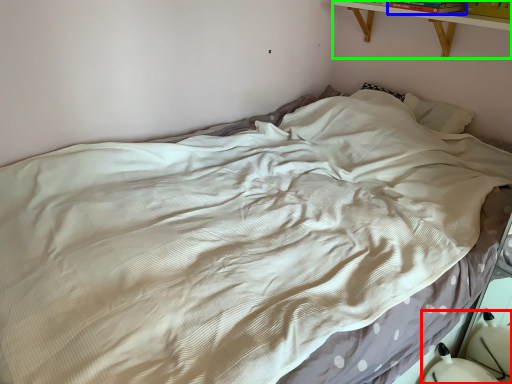
Question: Considering the real-world distances, which object is closest to swivel chair (highlighted by a red box)? book (highlighted by a blue box) or shelf (highlighted by a green box).

Choices:
 (A) book
 (B) shelf

Answer: (B)